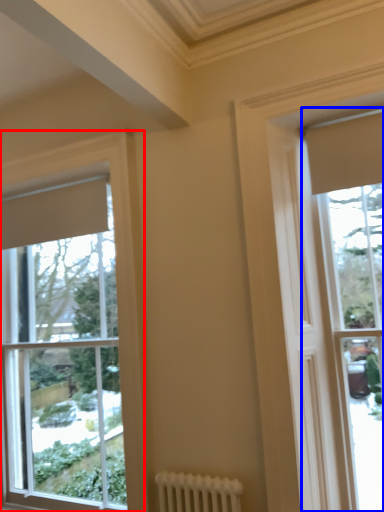
Question: Among these objects, which one is nearest to the camera, window (highlighted by a red box) or window (highlighted by a blue box)?

Choices:
 (A) window
 (B) window

Answer: (B)